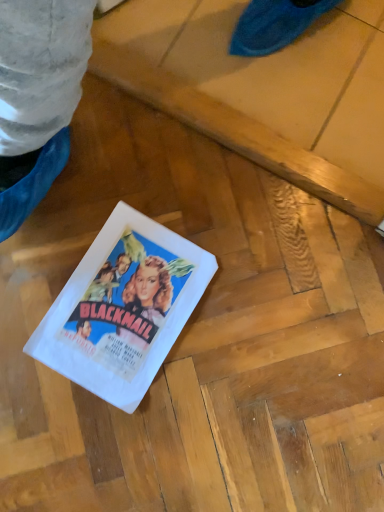
This screenshot has height=512, width=384. I want to click on blank area beneath white matte book at center (from a real-world perspective), so click(121, 298).